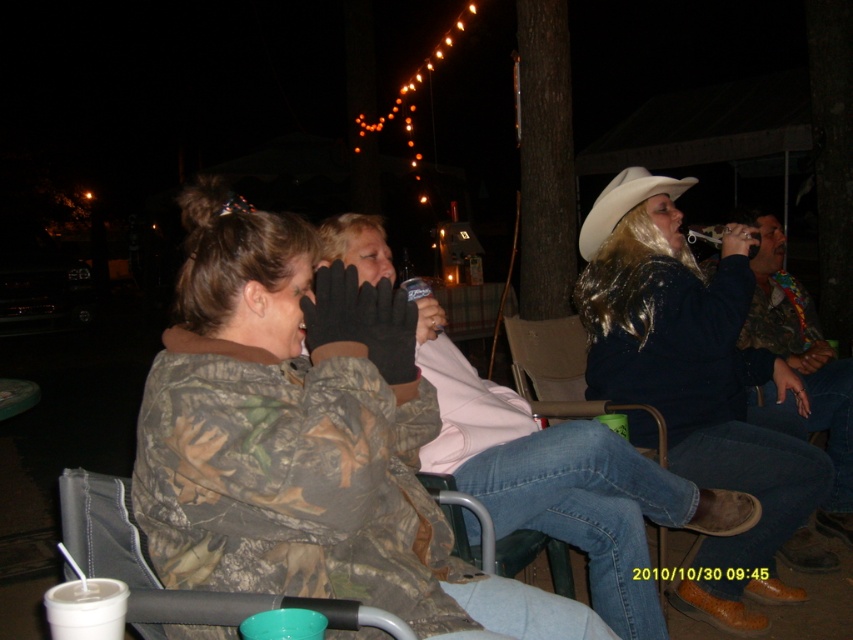
You are standing at the entrance of the event and want to locate the camouflage jacket at center and the white matte cowboy hat at upper right. Based on their positions, which object is closer to the left side of the image?

The white matte cowboy hat at upper right is closer to the left side because the camouflage jacket at center is to its right.

You are standing at the center of the gathering area and want to move towards the two points marked in the image. Which point, point (602, 630) or point (96, 612), is closer to you?

Point (602, 630) is closer to you because it is further to the viewer than point (96, 612).

You are standing at the viewer position in the image. There is a point at coordinates point (624, 209). Can you reach this point without moving your feet?

The point at coordinates point (624, 209) is 3.04 meters away from you, so you can reach it without moving your feet if your arm can extend that far. However, typically, a person cannot reach 3.04 meters without moving, so likely not.